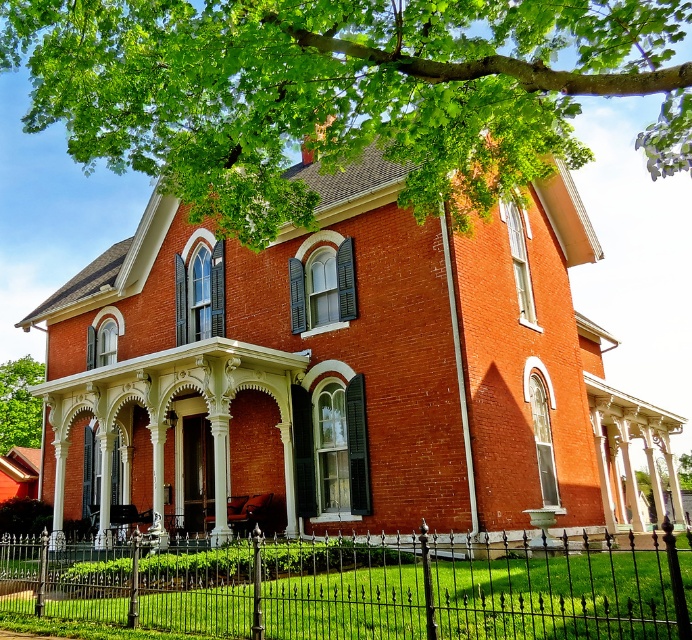
You are a delivery person trying to deliver a package to the house. The package needs to be placed on the black wrought iron fence at lower center. You are currently standing at the green leafy tree at upper center. Can you reach the fence without moving more than 6 meters?

The green leafy tree at upper center is 6.02 meters from the black wrought iron fence at lower center. Since the distance is slightly over 6 meters, you cannot reach the fence without moving more than 6 meters.

You are a landscape architect designing a garden for this house. You need to decide whether the green leafy tree at upper center can be planted in the space between the black wrought iron fence at lower center and the house. Based on their sizes, is this feasible?

The green leafy tree at upper center is smaller than the black wrought iron fence at lower center. Since the tree is smaller, it can be planted between the fence and the house without overcrowding the space.

You are standing in front of the house and want to enter through the main door. Which direction should you walk relative to the black wrought iron fence at lower center to reach the entrance?

Since the black wrought iron fence at lower center is located at point coordinates, you should walk towards the entrance which is above the central entrance. However, the exact direction depends on the spatial arrangement of the house and the fence. Based on the description, the entrance is part of the front facade with the porch supported by columns, so likely the entrance is centrally located. Therefore, to reach the entrance from the fence, you would need to walk towards the center of the house, which is